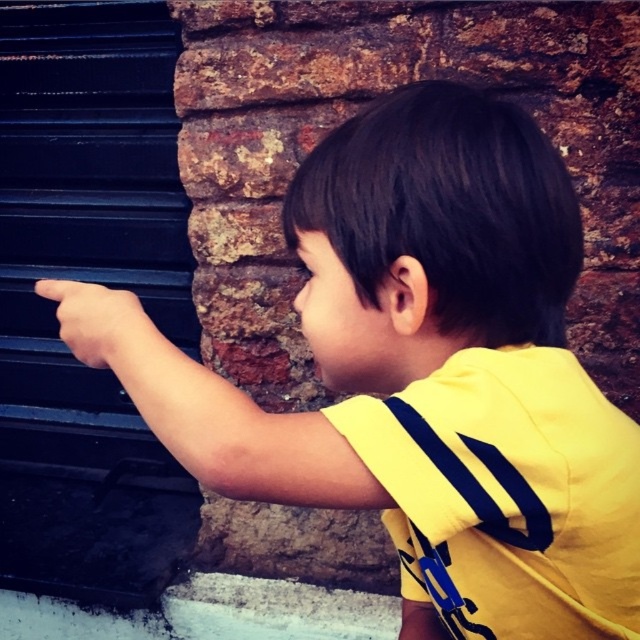
Does black matte garage door at left appear on the right side of smooth skin hand at left?

No, black matte garage door at left is not to the right of smooth skin hand at left.

Is black matte garage door at left positioned at the back of smooth skin hand at left?

That is True.

At what (x,y) coordinates should I click in order to perform the action: click on black matte garage door at left. Please return your answer as a coordinate pair (x, y). Image resolution: width=640 pixels, height=640 pixels. Looking at the image, I should click on (92, 282).

This screenshot has width=640, height=640. What are the coordinates of `black matte garage door at left` in the screenshot? It's located at (92, 282).